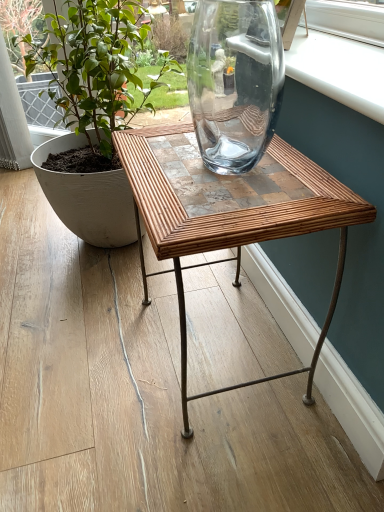
Where is `free spot in front of bamboowoodentable at center`? free spot in front of bamboowoodentable at center is located at coordinates (230, 466).